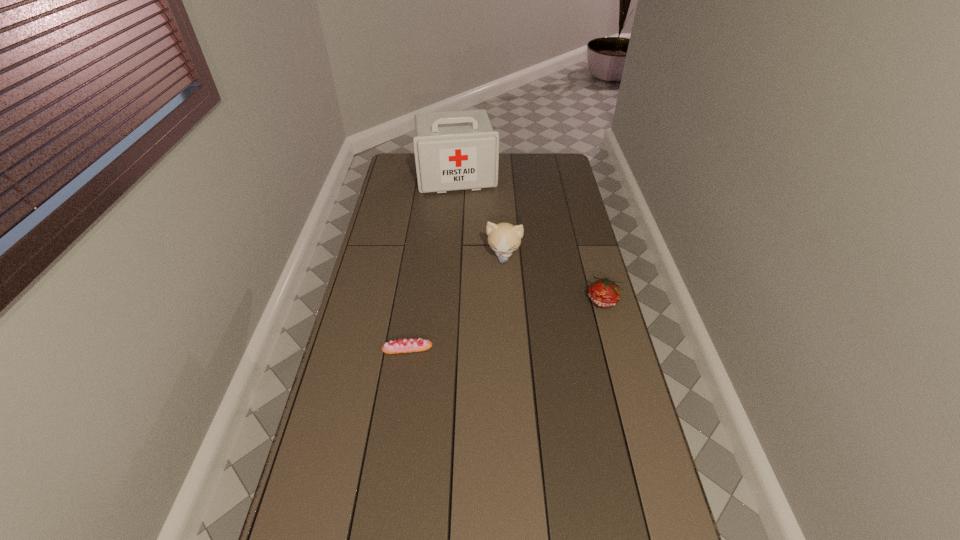
Find the location of a particular element. The height and width of the screenshot is (540, 960). vacant space located 0.140m on the face of the second farthest object is located at coordinates (497, 292).

I want to click on free space located on the face of the second farthest object, so click(x=492, y=318).

This screenshot has width=960, height=540. Identify the location of free space located 0.370m on the face of the second farthest object. (489, 341).

You are a GUI agent. You are given a task and a screenshot of the screen. Output one action in this format:
    pyautogui.click(x=<x>, y=<y>)
    Task: Click on the vacant area situated on the front-facing side of the tallest object
    The width and height of the screenshot is (960, 540).
    Given the screenshot: What is the action you would take?
    pyautogui.click(x=469, y=234)

Find the location of `vacant space situated on the front-facing side of the tallest object`. vacant space situated on the front-facing side of the tallest object is located at coordinates (470, 237).

I want to click on vacant space located on the front-facing side of the tallest object, so click(467, 217).

Where is `object present at the far edge`? The width and height of the screenshot is (960, 540). object present at the far edge is located at coordinates (457, 150).

I want to click on eclair that is at the left edge, so (413, 345).

At what (x,y) coordinates should I click in order to perform the action: click on the first-aid kit located in the left edge section of the desktop. Please return your answer as a coordinate pair (x, y). Image resolution: width=960 pixels, height=540 pixels. Looking at the image, I should click on (457, 150).

The height and width of the screenshot is (540, 960). What are the coordinates of `object at the right edge` in the screenshot? It's located at (603, 292).